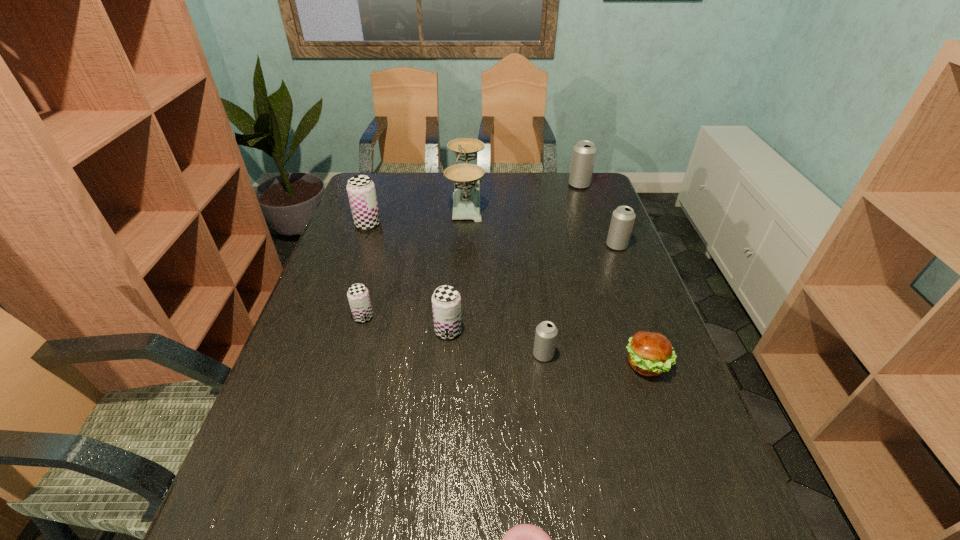
Identify the location of scale. (466, 177).

This screenshot has height=540, width=960. Identify the location of the farthest white beer can. (584, 152).

At what (x,y) coordinates should I click in order to perform the action: click on the biggest white beer can. Please return your answer as a coordinate pair (x, y). The image size is (960, 540). Looking at the image, I should click on (584, 152).

At what (x,y) coordinates should I click in order to perform the action: click on the biggest purple beer can. Please return your answer as a coordinate pair (x, y). The image size is (960, 540). Looking at the image, I should click on (361, 191).

The image size is (960, 540). What are the coordinates of `the leftmost object` in the screenshot? It's located at tap(361, 191).

The width and height of the screenshot is (960, 540). Identify the location of the second smallest purple beer can. (446, 301).

Locate an element on the screen. The image size is (960, 540). the third beer can from left to right is located at coordinates (446, 301).

Where is `the fourth nearest beer can`? the fourth nearest beer can is located at coordinates tap(622, 221).

I want to click on the second smallest white beer can, so click(x=622, y=221).

At what (x,y) coordinates should I click in order to perform the action: click on the smallest purple beer can. Please return your answer as a coordinate pair (x, y). The image size is (960, 540). Looking at the image, I should click on (358, 296).